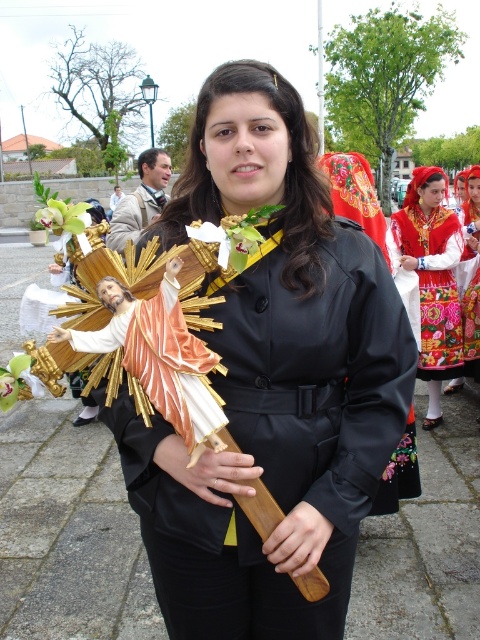
You are organizing a photo shoot and need to place a large camera tripod between the matte black coat at center and the embroidered fabric dress at center. Based on their widths, can the tripod fit between them without touching either?

The matte black coat at center might be wider than the embroidered fabric dress at center, so there might not be enough space for the tripod to fit between them without touching either.

You are an artist observing the scene and want to sketch the two main elements, the matte black coat at center and the green matte flower at upper left. Which one should you draw first if you want to capture their relative sizes accurately?

The green matte flower at upper left is taller than the matte black coat at center, so you should draw the green matte flower at upper left first to capture their relative sizes accurately.

You are an attendee at the event and want to take a photo of the embroidered fabric dress at center without any obstruction. Is the green matte flower at upper left blocking your view of it?

The embroidered fabric dress at center is positioned under the green matte flower at upper left, so the flower is blocking the view of the dress. Move to a position where the flower is not in front of the dress to capture an unobstructed photo.